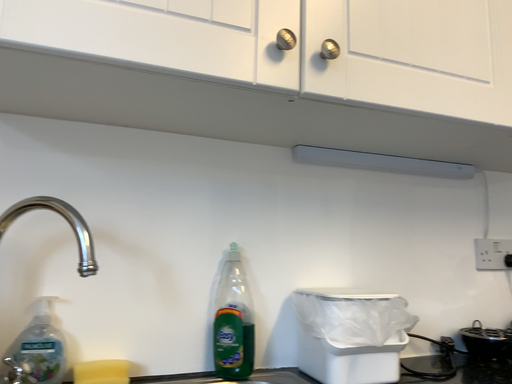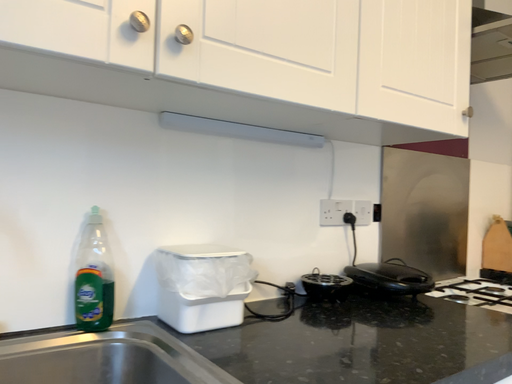
Question: Which way did the camera rotate in the video?

Choices:
 (A) rotated right
 (B) rotated left

Answer: (A)